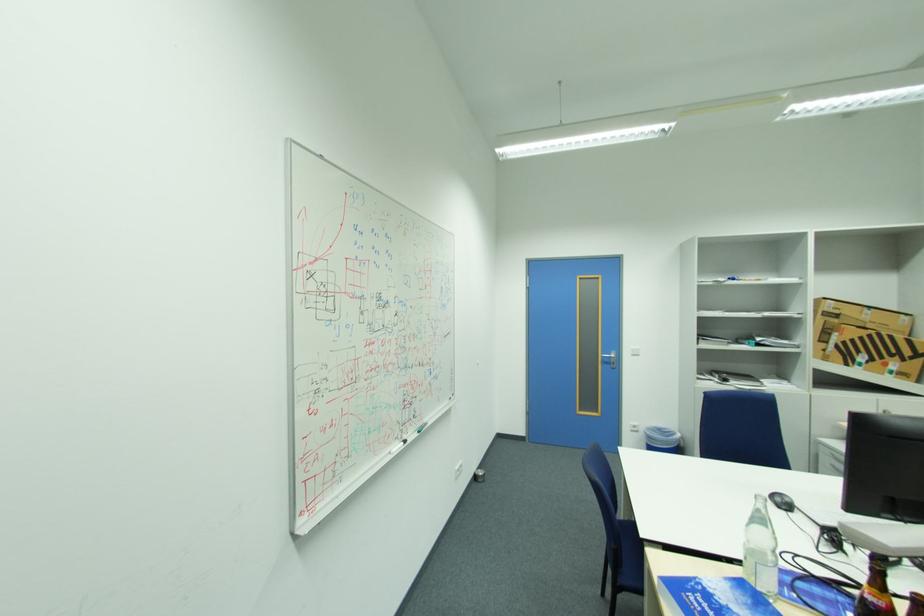
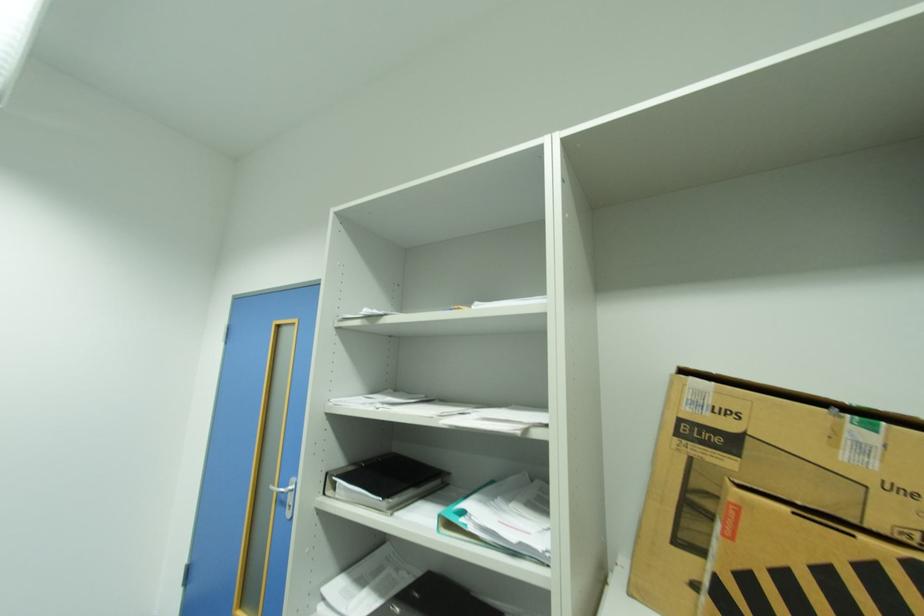
In the second image, find the point that corresponds to (833,328) in the first image.

(700, 487)